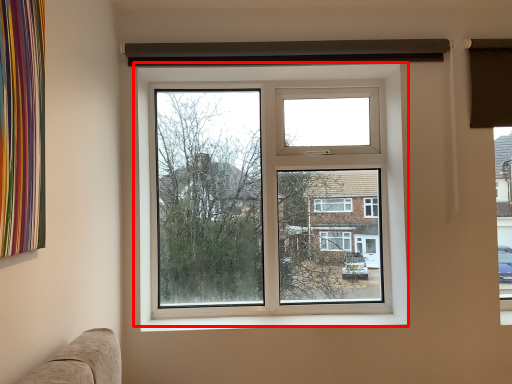
Question: From the image's perspective, what is the correct spatial positioning of window (annotated by the red box) in reference to window sill?

Choices:
 (A) below
 (B) above

Answer: (B)